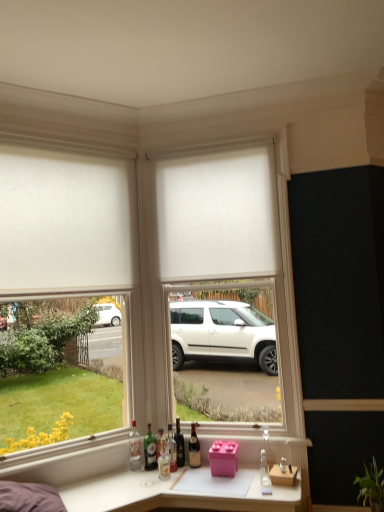
Find the location of `vacant region in front of clear glass bottle at center, the 5th bottle viewed from the right`. vacant region in front of clear glass bottle at center, the 5th bottle viewed from the right is located at coordinates (158, 475).